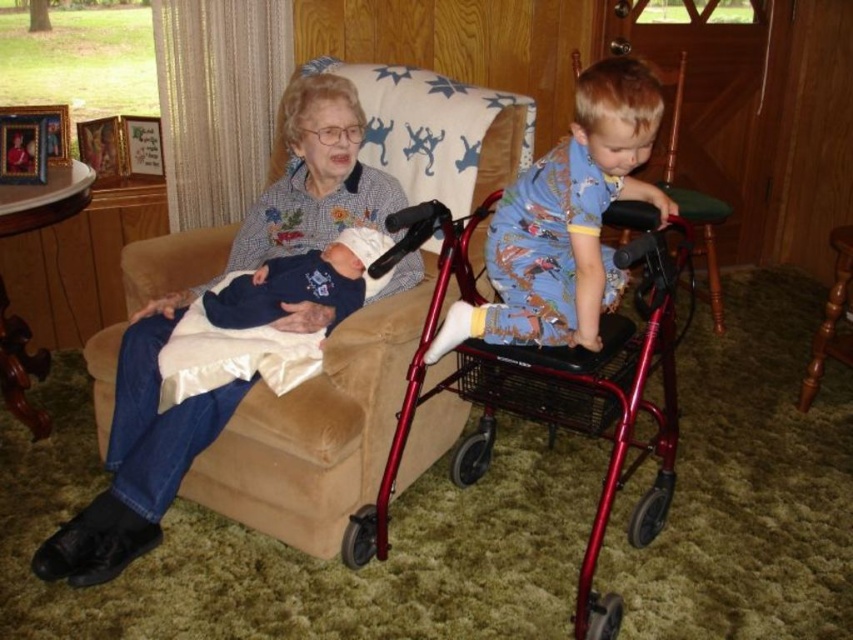
You are a photographer setting up a shoot in the scene described. You need to position a light source to illuminate both the matte blue shirt at center and the metallic red walker at center. Given their sizes, which object should you focus the light on first to ensure proper exposure?

The matte blue shirt at center has a smaller size compared to the metallic red walker at center, so you should focus the light on the smaller matte blue shirt at center first to ensure it is properly illuminated before adjusting for the larger metallic red walker at center.

You are a parent observing the scene. You see the metallic red walker at center and the blue cotton pajamas at center. Which object is located to the right of the other?

The metallic red walker at center is positioned on the right side of blue cotton pajamas at center.